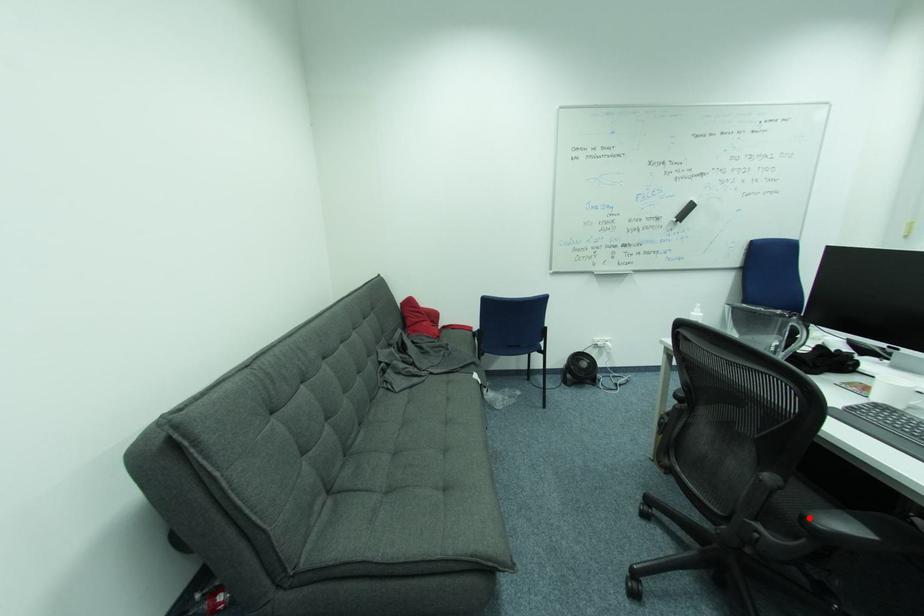
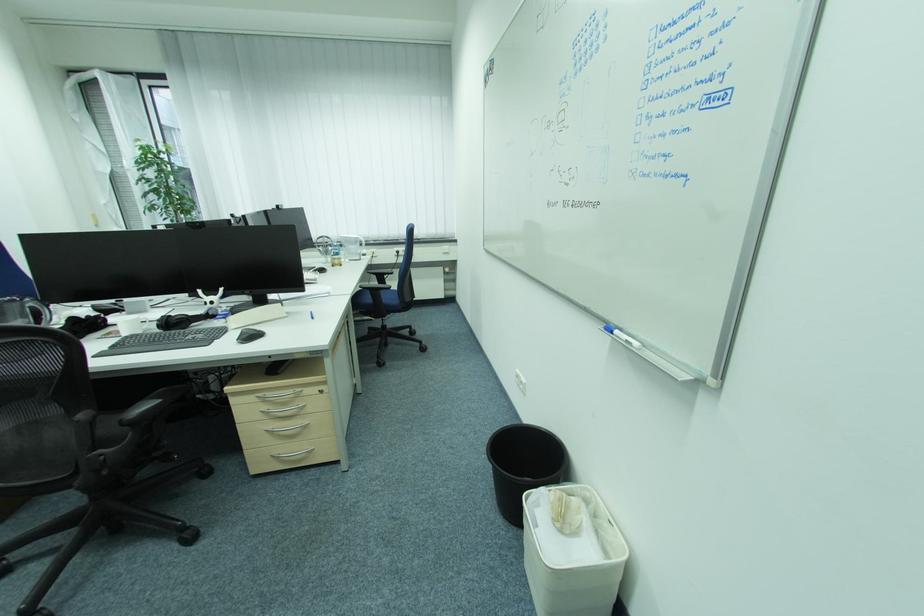
In the second image, find the point that corresponds to the highlighted location in the first image.

(128, 422)